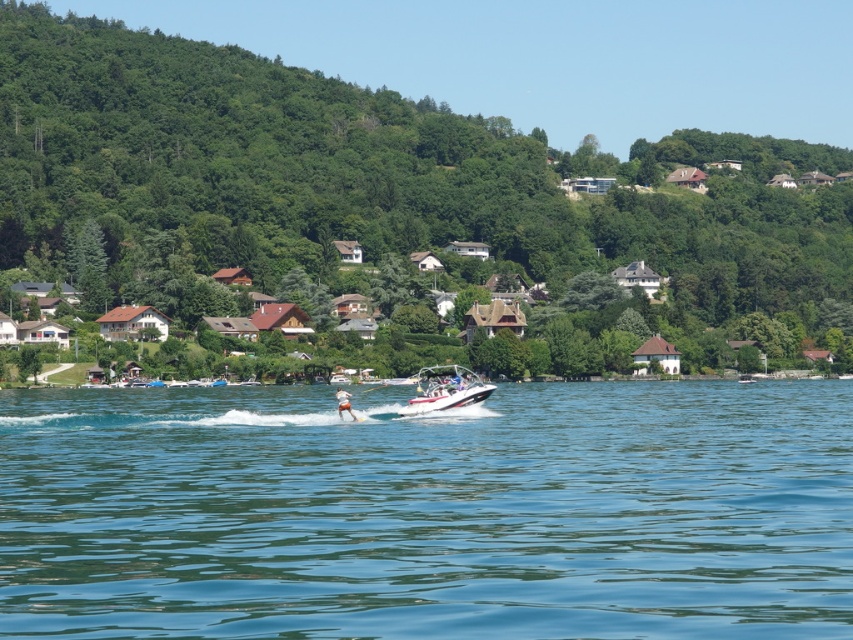
You are a photographer trying to capture the water skier and the boat in a single shot. Given the scene described, can you fit both the clear blue water at center and the white smooth water skier at center into your camera frame without moving the camera?

The clear blue water at center might be wider than the white smooth water skier at center, so there is a possibility that both can fit into the camera frame without moving it. However, the exact arrangement depends on the camera lens and framing angle.

You are a photographer trying to capture a shot of the green leafy tree at center and the white smooth water skier at center from the lakeside. Which object will appear taller in the photo?

The green leafy tree at center appears taller in the photo because it has a greater height compared to the white smooth water skier at center.

You are navigating a drone that needs to fly from the motorboat to the green leafy tree at center without crossing the water. Can you determine if this path is possible based on their positions?

The green leafy tree at center is located at point (367, 184). Since the motorboat is positioned slightly ahead and to the right of the skier in the water, and the tree is in the midground among houses, the drone can fly over the land area between the water and the tree to reach it without crossing the water.